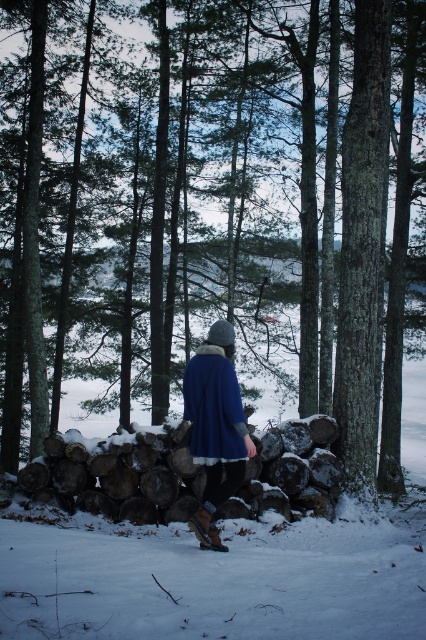
You are a hiker trying to stay warm in the cold winter forest. You have a blue woolen coat at center and a blue woolen cloak at center. Which one is closer to your body?

The blue woolen coat at center is closer to your body since it is only 5.00 inches away from the blue woolen cloak at center.